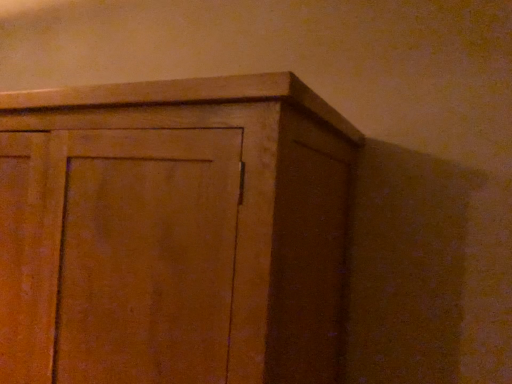
Locate an element on the screen. Image resolution: width=512 pixels, height=384 pixels. wooden cabinet at upper center is located at coordinates pos(173,233).

Describe the element at coordinates (173, 233) in the screenshot. Image resolution: width=512 pixels, height=384 pixels. I see `wooden cabinet at upper center` at that location.

In order to face wooden cabinet at upper center, should I rotate leftwards or rightwards?

To align with it, rotate left about 16.771°.

Where is `wooden cabinet at upper center`? The height and width of the screenshot is (384, 512). wooden cabinet at upper center is located at coordinates (173, 233).